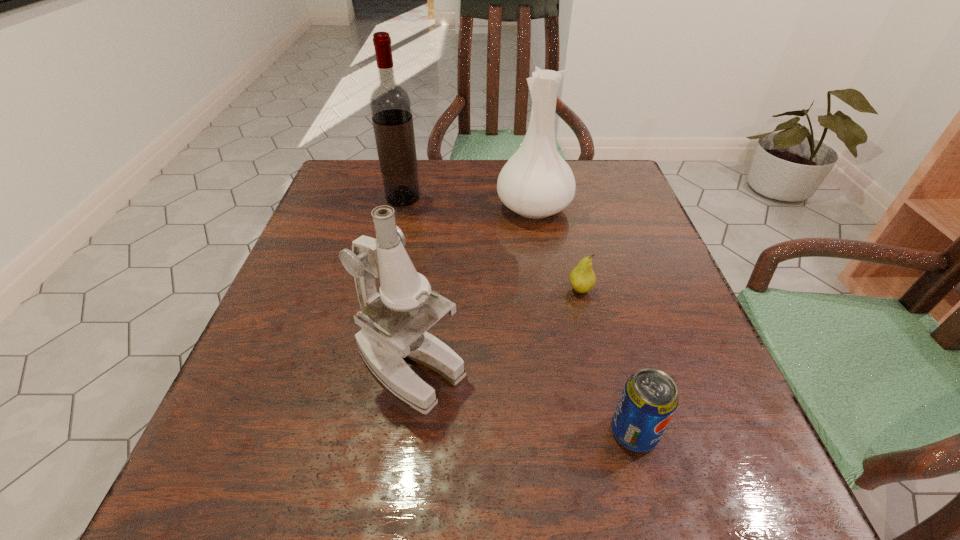
Locate an element on the screen. This screenshot has height=540, width=960. vacant region that satisfies the following two spatial constraints: 1. on the front side of the soda; 2. on the right side of the microscope is located at coordinates (400, 433).